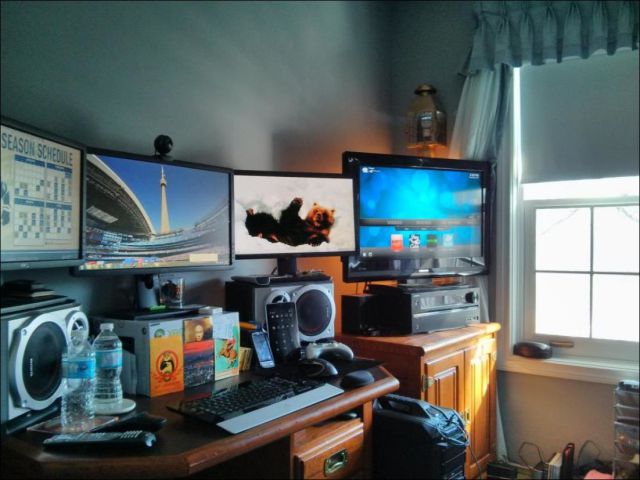
Find the location of `speaker`. speaker is located at coordinates (310, 317), (44, 374).